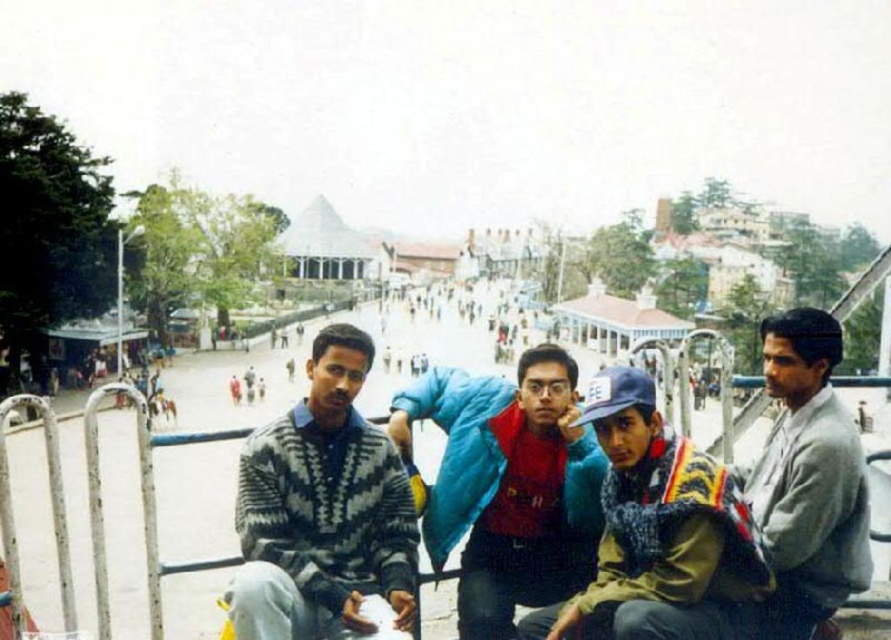
Can you confirm if gray and white knitted sweater at center is thinner than gray wool sweater at right?

Incorrect, gray and white knitted sweater at center's width is not less than gray wool sweater at right's.

Between gray and white knitted sweater at center and gray wool sweater at right, which one appears on the left side from the viewer's perspective?

Positioned to the left is gray and white knitted sweater at center.

Does point (293, 609) come in front of point (758, 488)?

That is True.

This screenshot has height=640, width=891. Identify the location of gray and white knitted sweater at center. (323, 509).

Is blue fuzzy jacket at center bigger than gray wool sweater at right?

Correct, blue fuzzy jacket at center is larger in size than gray wool sweater at right.

Can you confirm if blue fuzzy jacket at center is positioned above gray wool sweater at right?

Actually, blue fuzzy jacket at center is below gray wool sweater at right.

In the scene shown: Who is more forward, (493, 483) or (836, 500)?

Positioned in front is point (836, 500).

Locate an element on the screen. blue fuzzy jacket at center is located at coordinates (507, 484).

Can you confirm if gray and white knitted sweater at center is positioned below blue fuzzy jacket at center?

Indeed, gray and white knitted sweater at center is positioned under blue fuzzy jacket at center.

Does gray and white knitted sweater at center appear on the left side of blue fuzzy jacket at center?

Correct, you'll find gray and white knitted sweater at center to the left of blue fuzzy jacket at center.

Who is more distant from viewer, (341, 356) or (550, 573)?

Positioned behind is point (550, 573).

Locate an element on the screen. Image resolution: width=891 pixels, height=640 pixels. gray and white knitted sweater at center is located at coordinates (323, 509).